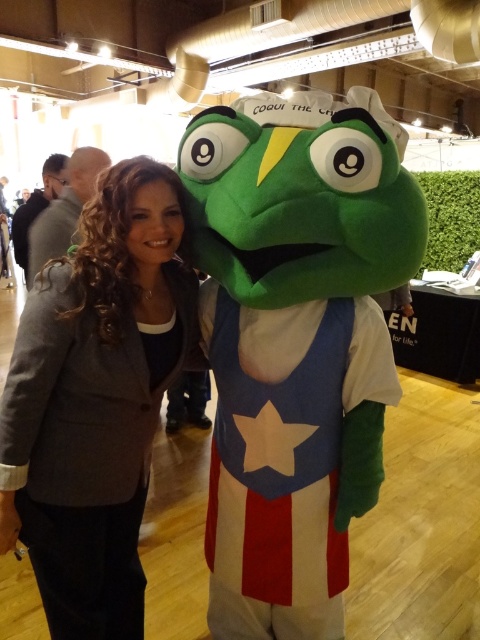
Question: Which of the following is the farthest from the observer?

Choices:
 (A) (315, 480)
 (B) (16, 445)

Answer: (A)

Question: Can you confirm if matte gray blazer at center is bigger than velvet green costume at center?

Choices:
 (A) yes
 (B) no

Answer: (A)

Question: Does matte gray blazer at center have a smaller size compared to velvet green costume at center?

Choices:
 (A) yes
 (B) no

Answer: (B)

Question: Which point appears closest to the camera in this image?

Choices:
 (A) (82, 477)
 (B) (365, 486)

Answer: (A)

Question: Does matte gray blazer at center appear on the left side of velvet green costume at center?

Choices:
 (A) no
 (B) yes

Answer: (B)

Question: Which point appears farthest from the camera in this image?

Choices:
 (A) (152, 192)
 (B) (311, 330)

Answer: (B)